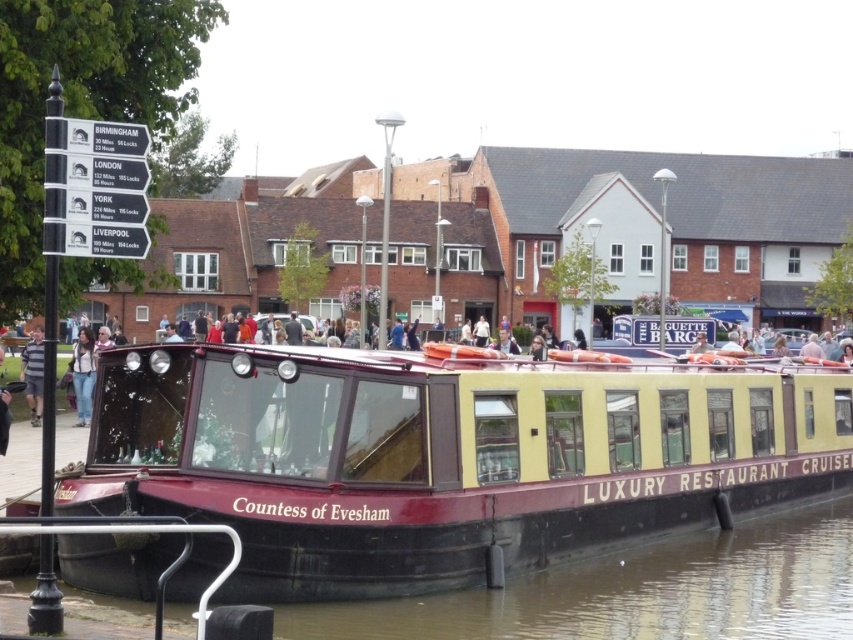
You are a photographer planning to capture the Countess of Evesham cruise boat and its surroundings. You notice a black rubber boat at lower center and a striped cotton shirt at left in your frame. Which object would you need to zoom in on more to make it appear larger in your photo?

The black rubber boat at lower center is smaller than the striped cotton shirt at left, so you would need to zoom in more on the black rubber boat at lower center to make it appear larger in the photo.

You are a photographer taking a picture of the maroon polished wood boat at center and the striped cotton shirt at left. Which object should you focus on first if you want to capture both in sharp focus?

The maroon polished wood boat at center is positioned under the striped cotton shirt at left, so focusing on the boat first would ensure both are in sharp focus as they are stacked vertically.